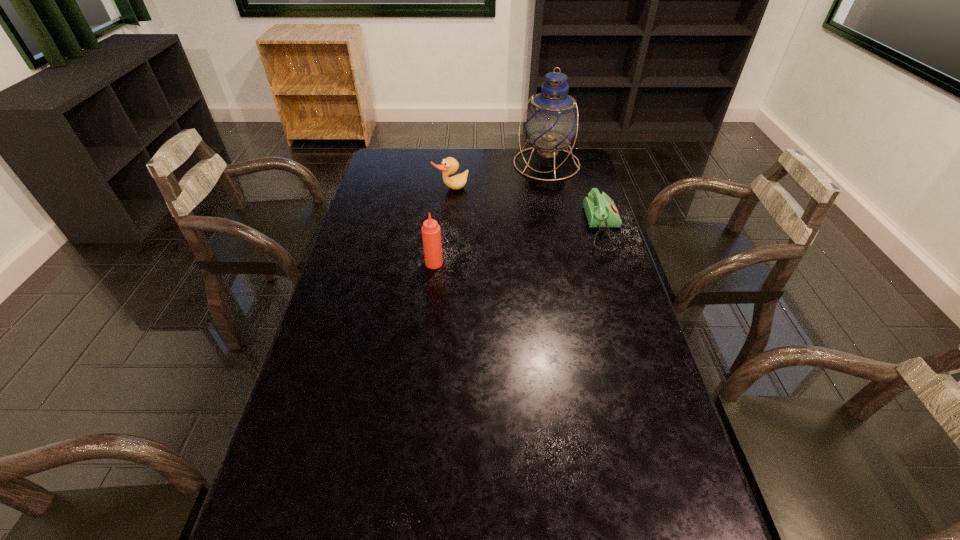
Where is `free space between the duck and the lantern`? The height and width of the screenshot is (540, 960). free space between the duck and the lantern is located at coordinates (499, 177).

In order to click on vacant area between the tallest object and the telephone in this screenshot , I will do `click(575, 197)`.

Locate an element on the screen. blank region between the tallest object and the Tabasco sauce is located at coordinates (491, 213).

You are a GUI agent. You are given a task and a screenshot of the screen. Output one action in this format:
    pyautogui.click(x=<x>, y=<y>)
    Task: Click on the vacant space that's between the third shortest object and the third nearest object
    
    Given the screenshot: What is the action you would take?
    pyautogui.click(x=443, y=226)

Image resolution: width=960 pixels, height=540 pixels. Find the location of `vacant area that lies between the second tallest object and the duck`. vacant area that lies between the second tallest object and the duck is located at coordinates (443, 226).

The height and width of the screenshot is (540, 960). In order to click on vacant area that lies between the lantern and the third shortest object in this screenshot , I will do `click(491, 213)`.

This screenshot has height=540, width=960. What are the coordinates of `vacant area that lies between the second shortest object and the farthest object` in the screenshot? It's located at [x=499, y=177].

Locate an element on the screen. This screenshot has height=540, width=960. vacant space that is in between the tallest object and the telephone is located at coordinates (575, 197).

At what (x,y) coordinates should I click in order to perform the action: click on free space between the third nearest object and the telephone. Please return your answer as a coordinate pair (x, y). Looking at the image, I should click on (527, 210).

Locate an element on the screen. vacant area between the third tallest object and the Tabasco sauce is located at coordinates (443, 226).